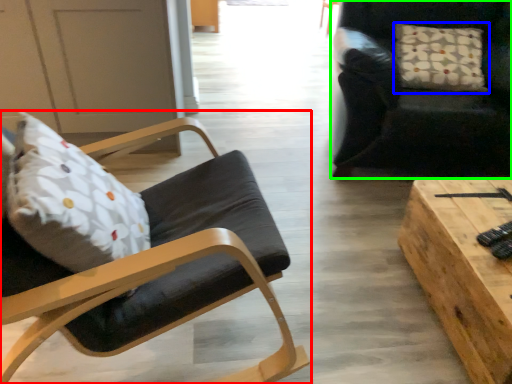
Question: Which is farther away from chair (highlighted by a red box)? pillow (highlighted by a blue box) or chair (highlighted by a green box)?

Choices:
 (A) pillow
 (B) chair

Answer: (A)